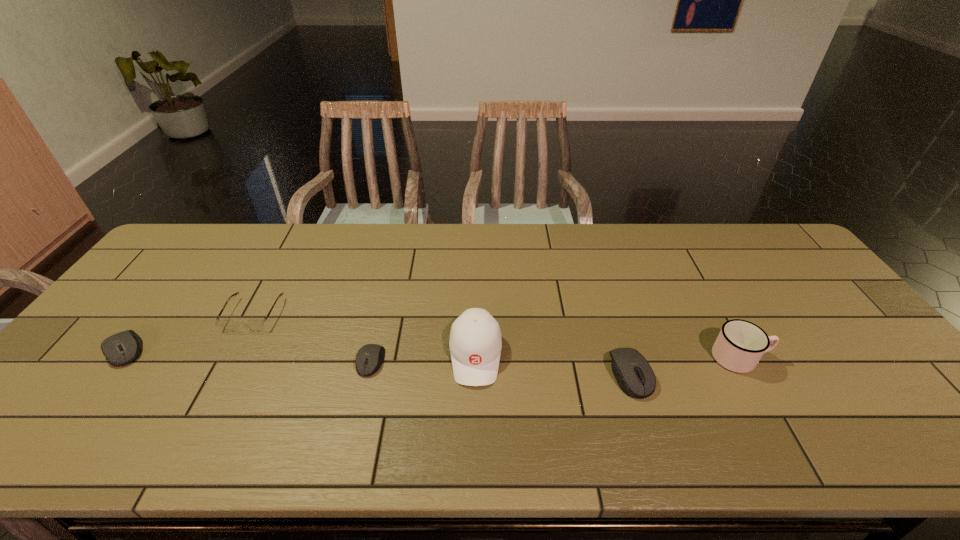
At what (x,y) coordinates should I click in order to perform the action: click on vacant area situated on the right of the leftmost computer equipment. Please return your answer as a coordinate pair (x, y). The image size is (960, 540). Looking at the image, I should click on (285, 349).

At what (x,y) coordinates should I click in order to perform the action: click on free location located on the back of the shortest computer equipment. Please return your answer as a coordinate pair (x, y). Looking at the image, I should click on (395, 260).

You are a GUI agent. You are given a task and a screenshot of the screen. Output one action in this format:
    pyautogui.click(x=<x>, y=<y>)
    Task: Click on the free spot located 0.350m on the back of the rightmost computer equipment
    The width and height of the screenshot is (960, 540).
    Given the screenshot: What is the action you would take?
    pyautogui.click(x=596, y=265)

Locate an element on the screen. vacant region located on the front-facing side of the second object from left to right is located at coordinates (236, 348).

Find the location of `free region located 0.290m on the side of the mug with the handle`. free region located 0.290m on the side of the mug with the handle is located at coordinates (881, 358).

Image resolution: width=960 pixels, height=540 pixels. I want to click on computer equipment that is positioned at the near edge, so click(x=634, y=375).

You are a GUI agent. You are given a task and a screenshot of the screen. Output one action in this format:
    pyautogui.click(x=<x>, y=<y>)
    Task: Click on the baseball cap at the near edge
    
    Given the screenshot: What is the action you would take?
    pos(475,343)

In order to click on object that is at the left edge in this screenshot , I will do `click(120, 349)`.

At what (x,y) coordinates should I click in order to perform the action: click on vacant space at the far edge. Please return your answer as a coordinate pair (x, y). Looking at the image, I should click on (618, 234).

The height and width of the screenshot is (540, 960). What are the coordinates of `free region at the near edge` in the screenshot? It's located at (136, 387).